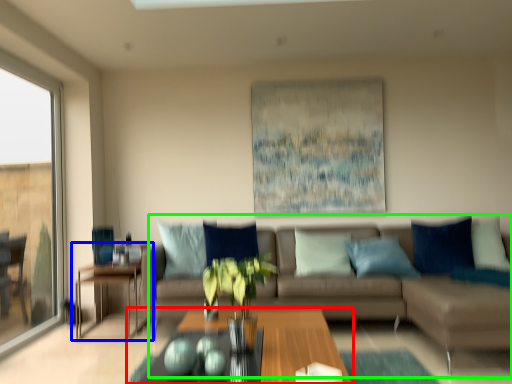
Question: Estimate the real-world distances between objects in this image. Which object is farther from coffee table (highlighted by a red box), table (highlighted by a blue box) or studio couch (highlighted by a green box)?

Choices:
 (A) table
 (B) studio couch

Answer: (A)